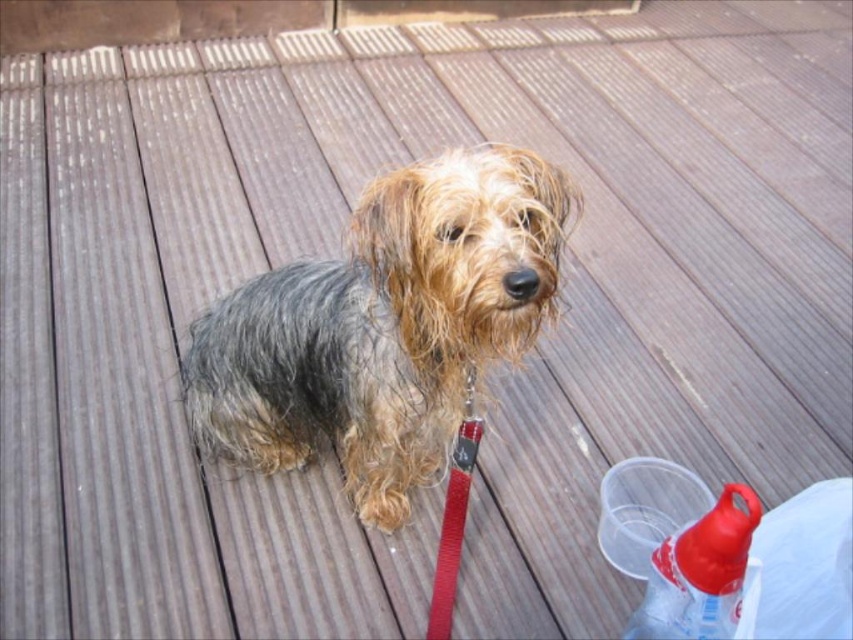
Consider the image. You are a delivery person who needs to place a new package at the exact location of the translucent plastic bottle at lower right. According to the image, what are the coordinates where you should place the package?

The coordinates for the translucent plastic bottle at lower right are at point [700,573], so you should place the package there.

You are a veterinarian examining the image of a dog on a wooden deck. The dog has wet fur and is wearing a red leash. You need to determine if the dog is facing towards or away from the leash. Based on the spatial relationship between the fuzzy fur dog at center and the red nylon leash at center, which direction is the dog facing?

The fuzzy fur dog at center is in front of the red nylon leash at center, meaning the dog is facing away from the leash.

From the picture: You are a dog owner who just finished walking your dog and notice the red nylon leash at center and the translucent plastic bottle at lower right. Which item is located to the right of the other?

The translucent plastic bottle at lower right is positioned on the right side of red nylon leash at center, so it is located to the right of the red nylon leash at center.